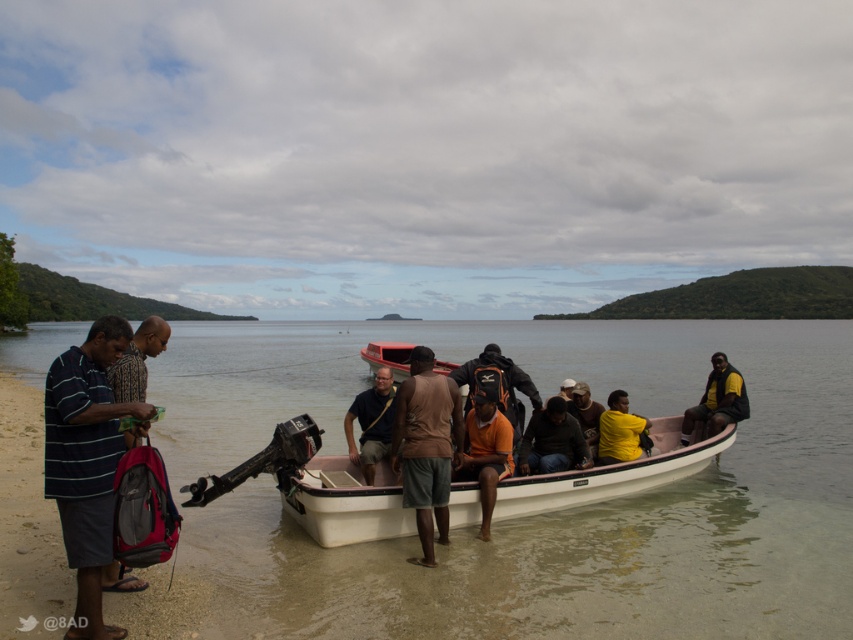
You are a hiker who just arrived at the coast and see the matte black backpack at lower left and the matte red boat at center. You want to place your new fishing rod in a secure spot. Which object should you choose to store it, and why?

The matte black backpack at lower left is located above the matte red boat at center, so it is more accessible for storing the fishing rod as it is positioned higher and closer to your reach while standing on the shore.

From the picture: You are a hiker who wants to place your matte black backpack at lower left into the matte red boat at center. Based on their widths, can you determine if the backpack will fit inside the boat?

The matte black backpack at lower left might be wider than matte red boat at center, so there is a possibility that the backpack will not fit inside the boat due to its width.